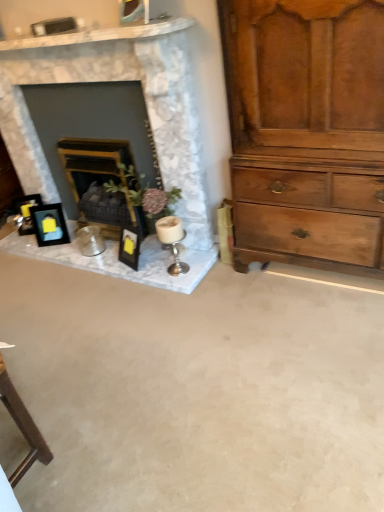
What is the approximate height of white marble fireplace at upper left, the 1th fireplace positioned from the left?

white marble fireplace at upper left, the 1th fireplace positioned from the left, is 3.77 feet in height.

Identify the location of white marble fireplace at upper left, acting as the second fireplace starting from the right. This screenshot has width=384, height=512. (150, 123).

Where is `matte black picture frame at left, which is counted as the 1th picture frame, starting from the left`? The image size is (384, 512). matte black picture frame at left, which is counted as the 1th picture frame, starting from the left is located at coordinates (25, 212).

Is point (253, 160) closer to viewer compared to point (58, 145)?

Yes.

Are light brown wooden chest of drawers at right and wooden mantelpiece at center, which is the second fireplace from left to right, far apart?

No, light brown wooden chest of drawers at right is in close proximity to wooden mantelpiece at center, which is the second fireplace from left to right.

In the scene shown: Would you say light brown wooden chest of drawers at right is to the left or to the right of wooden mantelpiece at center, which is the second fireplace from left to right, in the picture?

Clearly, light brown wooden chest of drawers at right is on the right of wooden mantelpiece at center, which is the second fireplace from left to right, in the image.

Is wooden mantelpiece at center, the 1th fireplace when ordered from right to left, a part of light brown wooden chest of drawers at right?

No, wooden mantelpiece at center, the 1th fireplace when ordered from right to left, is not inside light brown wooden chest of drawers at right.

Relative to silver metallic candle holder at center, is matte black picture frame at left, which is the 2th picture frame in left-to-right order, in front or behind?

Visually, matte black picture frame at left, which is the 2th picture frame in left-to-right order, is located behind silver metallic candle holder at center.

Is matte black picture frame at left, which is the 1th picture frame in right-to-left order, positioned far away from silver metallic candle holder at center?

Answer: No, matte black picture frame at left, which is the 1th picture frame in right-to-left order, is not far from silver metallic candle holder at center.

From the image's perspective, is matte black picture frame at left, which is the 2th picture frame in left-to-right order, above or below silver metallic candle holder at center?

Based on their image positions, matte black picture frame at left, which is the 2th picture frame in left-to-right order, is located above silver metallic candle holder at center.

Is matte black picture frame at left, which is the 1th picture frame in right-to-left order, bigger or smaller than silver metallic candle holder at center?

Clearly, matte black picture frame at left, which is the 1th picture frame in right-to-left order, is larger in size than silver metallic candle holder at center.

Can you confirm if matte black picture frame at left, the second picture frame positioned from the right, is wider than white marble fireplace at upper left, acting as the second fireplace starting from the right?

In fact, matte black picture frame at left, the second picture frame positioned from the right, might be narrower than white marble fireplace at upper left, acting as the second fireplace starting from the right.

From the image's perspective, which object appears higher, matte black picture frame at left, the second picture frame positioned from the right, or white marble fireplace at upper left, the 1th fireplace positioned from the left?

white marble fireplace at upper left, the 1th fireplace positioned from the left, appears higher in the image.

Is matte black picture frame at left, the second picture frame positioned from the right, positioned with its back to white marble fireplace at upper left, acting as the second fireplace starting from the right?

Yes, white marble fireplace at upper left, acting as the second fireplace starting from the right, is at the back of matte black picture frame at left, the second picture frame positioned from the right.

From a real-world perspective, is matte black picture frame at left, the second picture frame positioned from the right, positioned under white marble fireplace at upper left, the 1th fireplace positioned from the left, based on gravity?

Yes, from a real-world perspective, matte black picture frame at left, the second picture frame positioned from the right, is below white marble fireplace at upper left, the 1th fireplace positioned from the left.

At what (x,y) coordinates should I click in order to perform the action: click on the 2nd picture frame counting from the left side of the silver metallic candle holder at center. Please return your answer as a coordinate pair (x, y). Looking at the image, I should click on (25, 212).

Is silver metallic candle holder at center inside matte black picture frame at left, the second picture frame positioned from the right?

No, silver metallic candle holder at center is not inside matte black picture frame at left, the second picture frame positioned from the right.

Can you confirm if matte black picture frame at left, which is counted as the 1th picture frame, starting from the left, is thinner than silver metallic candle holder at center?

Yes.

Can you tell me how much matte black picture frame at left, the second picture frame positioned from the right, and silver metallic candle holder at center differ in facing direction?

31.2 degrees separate the facing orientations of matte black picture frame at left, the second picture frame positioned from the right, and silver metallic candle holder at center.

Can you see white marble fireplace at upper left, the 1th fireplace positioned from the left, touching light brown wooden chest of drawers at right?

No, white marble fireplace at upper left, the 1th fireplace positioned from the left, is not in contact with light brown wooden chest of drawers at right.

Between white marble fireplace at upper left, the 1th fireplace positioned from the left, and light brown wooden chest of drawers at right, which one has larger width?

With larger width is light brown wooden chest of drawers at right.

This screenshot has width=384, height=512. Find the location of `chest of drawers above the white marble fireplace at upper left, the 1th fireplace positioned from the left (from a real-world perspective)`. chest of drawers above the white marble fireplace at upper left, the 1th fireplace positioned from the left (from a real-world perspective) is located at coordinates (306, 129).

Is white marble fireplace at upper left, the 1th fireplace positioned from the left, situated inside light brown wooden chest of drawers at right or outside?

white marble fireplace at upper left, the 1th fireplace positioned from the left, is outside light brown wooden chest of drawers at right.

From the image's perspective, between silver metallic candle holder at center and matte black picture frame at left, which is the 2th picture frame in left-to-right order, which one is located above?

matte black picture frame at left, which is the 2th picture frame in left-to-right order, from the image's perspective.

Considering the sizes of objects silver metallic candle holder at center and matte black picture frame at left, which is the 2th picture frame in left-to-right order, in the image provided, who is bigger, silver metallic candle holder at center or matte black picture frame at left, which is the 2th picture frame in left-to-right order,?

Bigger between the two is matte black picture frame at left, which is the 2th picture frame in left-to-right order.

What are the coordinates of `candle holder that appears above the matte black picture frame at left, which is the 1th picture frame in right-to-left order (from a real-world perspective)` in the screenshot? It's located at (172, 241).

Considering the sizes of objects silver metallic candle holder at center and matte black picture frame at left, which is the 1th picture frame in right-to-left order, in the image provided, who is thinner, silver metallic candle holder at center or matte black picture frame at left, which is the 1th picture frame in right-to-left order,?

matte black picture frame at left, which is the 1th picture frame in right-to-left order, is thinner.

From a real-world perspective, is silver metallic candle holder at center above or below matte black picture frame at left, the second picture frame positioned from the right?

From a real-world perspective, silver metallic candle holder at center is physically above matte black picture frame at left, the second picture frame positioned from the right.

Who is smaller, silver metallic candle holder at center or matte black picture frame at left, the second picture frame positioned from the right?

With smaller size is silver metallic candle holder at center.

Based on their positions, is silver metallic candle holder at center located to the left or right of matte black picture frame at left, the second picture frame positioned from the right?

In the image, silver metallic candle holder at center appears on the right side of matte black picture frame at left, the second picture frame positioned from the right.

Which object is wider, silver metallic candle holder at center or matte black picture frame at left, the second picture frame positioned from the right?

silver metallic candle holder at center is wider.

Where is `chest of drawers in front of the wooden mantelpiece at center, the 1th fireplace when ordered from right to left`? This screenshot has width=384, height=512. chest of drawers in front of the wooden mantelpiece at center, the 1th fireplace when ordered from right to left is located at coordinates (306, 129).

From a real-world perspective, which picture frame is the 2nd one underneath the silver metallic candle holder at center? Please provide its 2D coordinates.

[(49, 225)]

Estimate the real-world distances between objects in this image. Which object is further from silver metallic candle holder at center, matte black picture frame at left, which is the 1th picture frame in right-to-left order, or wooden mantelpiece at center, the 1th fireplace when ordered from right to left?

Based on the image, matte black picture frame at left, which is the 1th picture frame in right-to-left order, appears to be further to silver metallic candle holder at center.

Looking at the image, which one is located further to wooden mantelpiece at center, the 1th fireplace when ordered from right to left, silver metallic candle holder at center or matte black picture frame at left, the second picture frame positioned from the right?

The object further to wooden mantelpiece at center, the 1th fireplace when ordered from right to left, is silver metallic candle holder at center.

Looking at the image, which one is located closer to light brown wooden chest of drawers at right, matte black picture frame at left, which is the 1th picture frame in right-to-left order, or white marble fireplace at upper left, the 1th fireplace positioned from the left?

white marble fireplace at upper left, the 1th fireplace positioned from the left.

Which object lies further to the anchor point matte black picture frame at left, which is the 2th picture frame in left-to-right order, silver metallic candle holder at center or white marble fireplace at upper left, the 1th fireplace positioned from the left?

silver metallic candle holder at center is further to matte black picture frame at left, which is the 2th picture frame in left-to-right order.

Considering their positions, is light brown wooden chest of drawers at right positioned closer to matte black picture frame at left, which is the 1th picture frame in right-to-left order, than silver metallic candle holder at center?

Based on the image, silver metallic candle holder at center appears to be nearer to matte black picture frame at left, which is the 1th picture frame in right-to-left order.

Based on their spatial positions, is matte black picture frame at left, which is counted as the 1th picture frame, starting from the left, or wooden mantelpiece at center, which is the second fireplace from left to right, closer to light brown wooden chest of drawers at right?

The object closer to light brown wooden chest of drawers at right is wooden mantelpiece at center, which is the second fireplace from left to right.

Which object lies nearer to the anchor point white marble fireplace at upper left, the 1th fireplace positioned from the left, light brown wooden chest of drawers at right or matte black picture frame at left, which is the 1th picture frame in right-to-left order?

light brown wooden chest of drawers at right lies closer to white marble fireplace at upper left, the 1th fireplace positioned from the left, than the other object.

Which object lies nearer to the anchor point matte black picture frame at left, the second picture frame positioned from the right, wooden mantelpiece at center, which is the second fireplace from left to right, or white marble fireplace at upper left, the 1th fireplace positioned from the left?

The object closer to matte black picture frame at left, the second picture frame positioned from the right, is wooden mantelpiece at center, which is the second fireplace from left to right.

Locate an element on the screen. The height and width of the screenshot is (512, 384). candle holder between white marble fireplace at upper left, the 1th fireplace positioned from the left, and matte black picture frame at left, which is the 2th picture frame in left-to-right order, in the front-back direction is located at coordinates (172, 241).

Find the location of `fireplace between white marble fireplace at upper left, acting as the second fireplace starting from the right, and matte black picture frame at left, which is the 2th picture frame in left-to-right order, from front to back`. fireplace between white marble fireplace at upper left, acting as the second fireplace starting from the right, and matte black picture frame at left, which is the 2th picture frame in left-to-right order, from front to back is located at coordinates (98, 181).

Find the location of a particular element. This screenshot has height=512, width=384. picture frame between matte black picture frame at left, which is counted as the 1th picture frame, starting from the left, and light brown wooden chest of drawers at right from left to right is located at coordinates (49, 225).

Identify the location of picture frame between matte black picture frame at left, the second picture frame positioned from the right, and wooden mantelpiece at center, which is the second fireplace from left to right, in the horizontal direction. (49, 225).